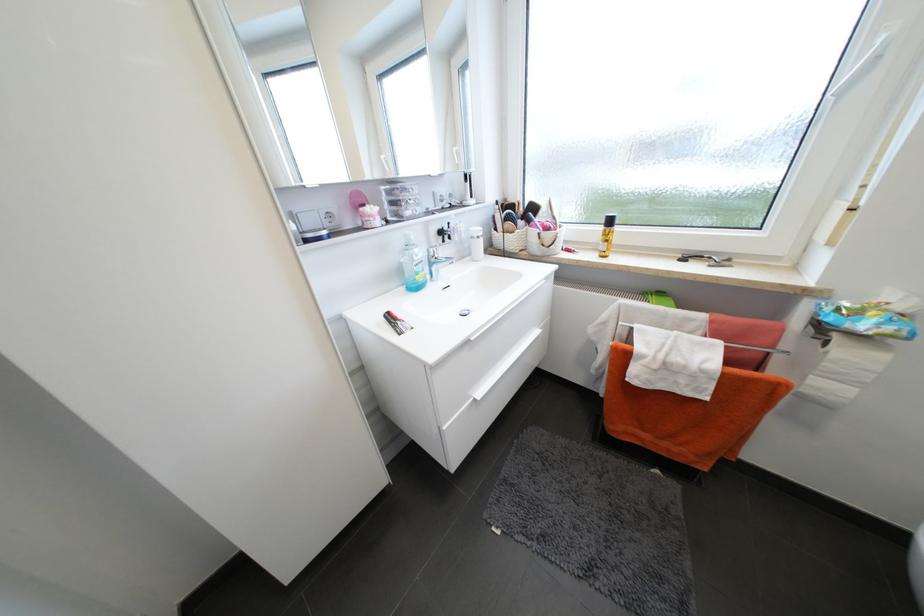
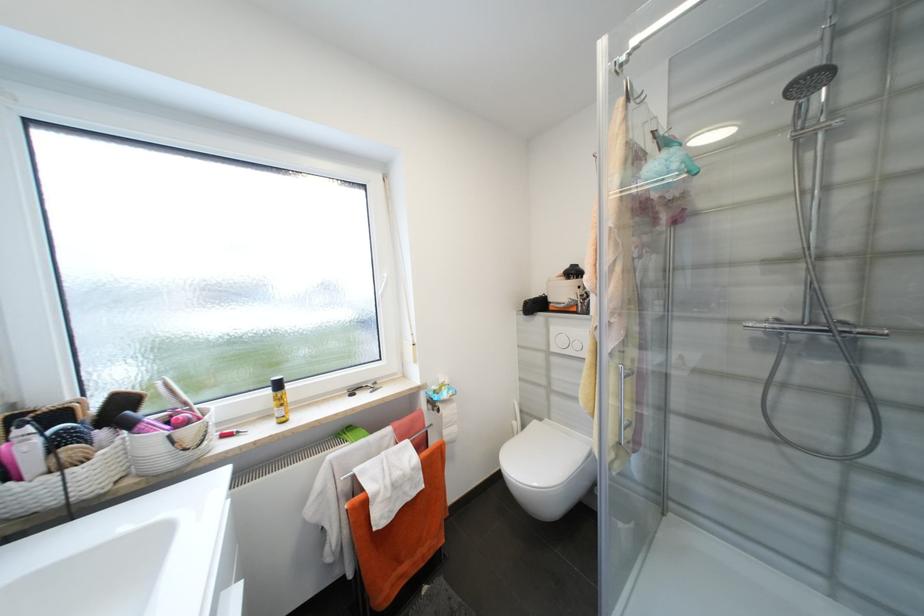
The point at (x=832, y=345) is marked in the first image. Where is the corresponding point in the second image?

(444, 411)